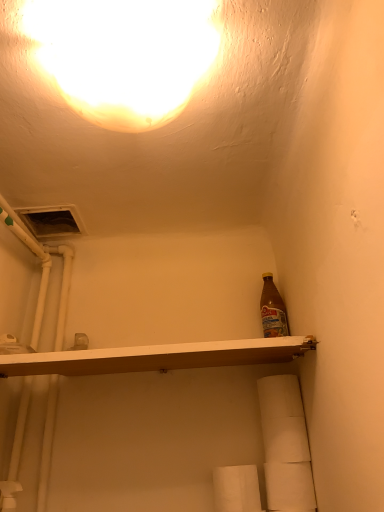
Question: Does white matte toilet paper at lower right, the 4th toilet paper positioned from the bottom, have a larger size compared to white matte toilet paper at lower right, which is the 3th toilet paper in top-to-bottom order?

Choices:
 (A) no
 (B) yes

Answer: (B)

Question: Can you confirm if white matte toilet paper at lower right, marked as the first toilet paper in a top-to-bottom arrangement, is shorter than white matte toilet paper at lower right, which is the 3th toilet paper in top-to-bottom order?

Choices:
 (A) no
 (B) yes

Answer: (A)

Question: Can you confirm if white matte toilet paper at lower right, the 4th toilet paper positioned from the bottom, is positioned to the right of white matte toilet paper at lower right, the second toilet paper from the bottom?

Choices:
 (A) yes
 (B) no

Answer: (B)

Question: Can you confirm if white matte toilet paper at lower right, marked as the first toilet paper in a top-to-bottom arrangement, is positioned to the left of white matte toilet paper at lower right, which is the 3th toilet paper in top-to-bottom order?

Choices:
 (A) yes
 (B) no

Answer: (A)

Question: From a real-world perspective, is white matte toilet paper at lower right, the 4th toilet paper positioned from the bottom, below white matte toilet paper at lower right, which is the 3th toilet paper in top-to-bottom order?

Choices:
 (A) yes
 (B) no

Answer: (B)

Question: Does white matte toilet paper at lower right, the 4th toilet paper positioned from the bottom, come in front of white matte toilet paper at lower right, which is the 3th toilet paper in top-to-bottom order?

Choices:
 (A) yes
 (B) no

Answer: (B)

Question: Is the surface of white matte toilet paper at lower right, the second toilet paper from the bottom, in direct contact with white matte toilet paper at lower right, which is the third toilet paper in bottom-to-top order?

Choices:
 (A) yes
 (B) no

Answer: (A)

Question: Can you confirm if white matte toilet paper at lower right, which is the 3th toilet paper in top-to-bottom order, is taller than white matte toilet paper at lower right, which is the 2th toilet paper in top-to-bottom order?

Choices:
 (A) no
 (B) yes

Answer: (A)

Question: From a real-world perspective, is white matte toilet paper at lower right, the second toilet paper from the bottom, positioned over white matte toilet paper at lower right, which is the third toilet paper in bottom-to-top order, based on gravity?

Choices:
 (A) yes
 (B) no

Answer: (B)

Question: Considering the relative sizes of white matte toilet paper at lower right, the second toilet paper from the bottom, and white matte toilet paper at lower right, which is the third toilet paper in bottom-to-top order, in the image provided, is white matte toilet paper at lower right, the second toilet paper from the bottom, shorter than white matte toilet paper at lower right, which is the third toilet paper in bottom-to-top order,?

Choices:
 (A) no
 (B) yes

Answer: (B)

Question: Considering the relative positions of white matte toilet paper at lower right, which is the 3th toilet paper in top-to-bottom order, and white matte toilet paper at lower right, which is the third toilet paper in bottom-to-top order, in the image provided, is white matte toilet paper at lower right, which is the 3th toilet paper in top-to-bottom order, to the right of white matte toilet paper at lower right, which is the third toilet paper in bottom-to-top order, from the viewer's perspective?

Choices:
 (A) yes
 (B) no

Answer: (A)

Question: Would you say white matte toilet paper at lower right, which is the 3th toilet paper in top-to-bottom order, is a long distance from white matte toilet paper at lower right, which is the 2th toilet paper in top-to-bottom order?

Choices:
 (A) yes
 (B) no

Answer: (B)

Question: Does white matte toilet paper at lower right, marked as the first toilet paper in a top-to-bottom arrangement, lie behind white paper towel at lower center, placed as the fourth toilet paper when sorted from top to bottom?

Choices:
 (A) no
 (B) yes

Answer: (B)